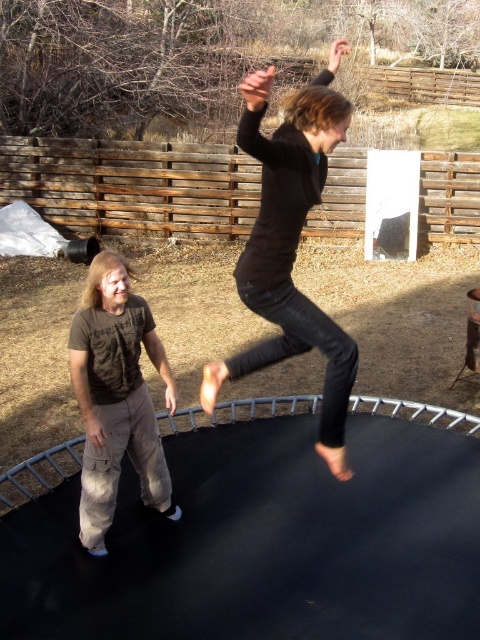
You are a photographer trying to capture a closeup shot of both the black matte jeans at center and the brown cotton shirt at left. Your camera has a minimum focusing distance of 24 inches. Can you take the photo without moving either object?

The black matte jeans at center and brown cotton shirt at left are 26.25 inches apart, which is beyond the camera minimum focusing distance of 24 inches. Therefore, you can take the photo without moving either object.

You are a photographer trying to capture a photo of the black matte jeans at center and the brown cotton shirt at left. Which object should you focus on first if you want to ensure both are in focus, considering their positions?

The black matte jeans at center is positioned over the brown cotton shirt at left, so focusing on the black matte jeans at center first would ensure both are in focus since it is closer to the camera.